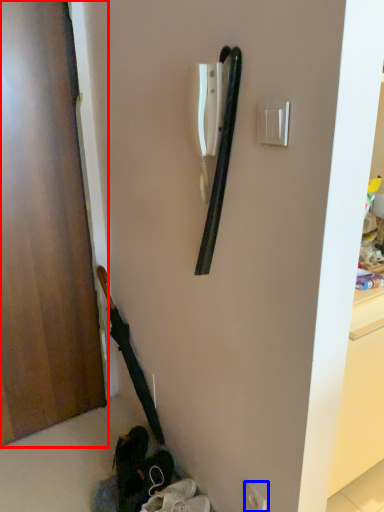
Question: Which point is closer to the camera, door (highlighted by a red box) or electric outlet (highlighted by a blue box)?

Choices:
 (A) door
 (B) electric outlet

Answer: (A)